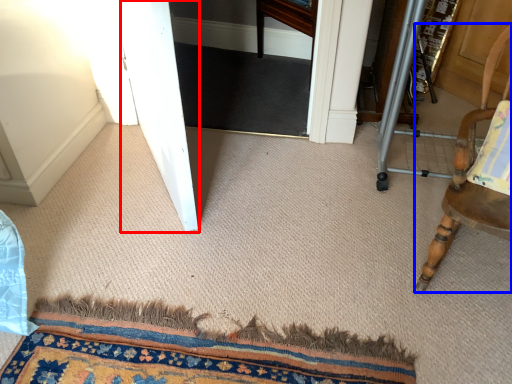
Question: Which of the following is the closest to the observer, screen door (highlighted by a red box) or chair (highlighted by a blue box)?

Choices:
 (A) screen door
 (B) chair

Answer: (B)